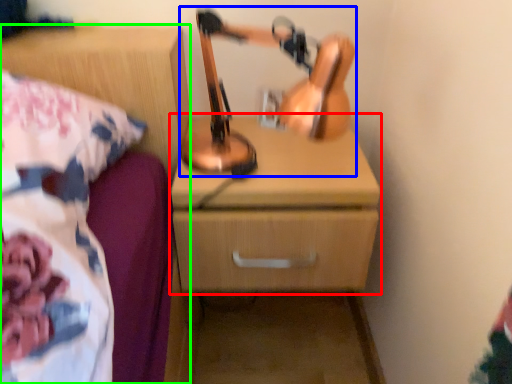
Question: Estimate the real-world distances between objects in this image. Which object is closer to chest of drawers (highlighted by a red box), table lamp (highlighted by a blue box) or nightstand (highlighted by a green box)?

Choices:
 (A) table lamp
 (B) nightstand

Answer: (A)